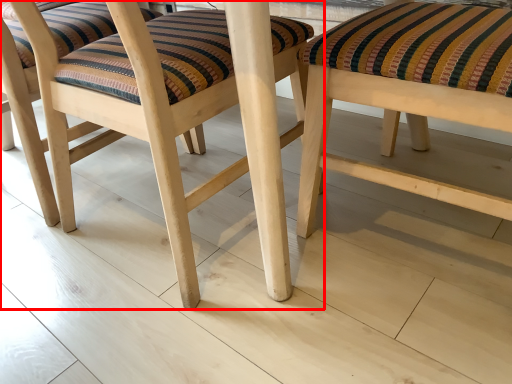
Question: From the image's perspective, where is stool (annotated by the red box) located in relation to stool in the image?

Choices:
 (A) below
 (B) above

Answer: (B)